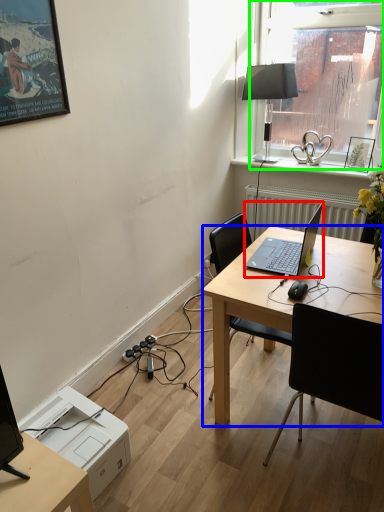
Question: Estimate the real-world distances between objects in this image. Which object is farther from laptop (highlighted by a red box), desk (highlighted by a blue box) or window (highlighted by a green box)?

Choices:
 (A) desk
 (B) window

Answer: (B)